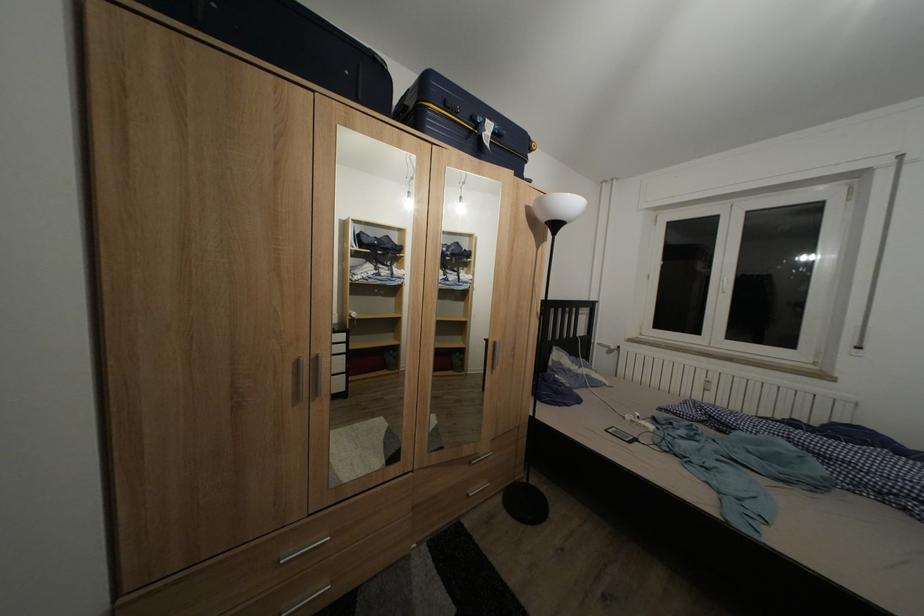
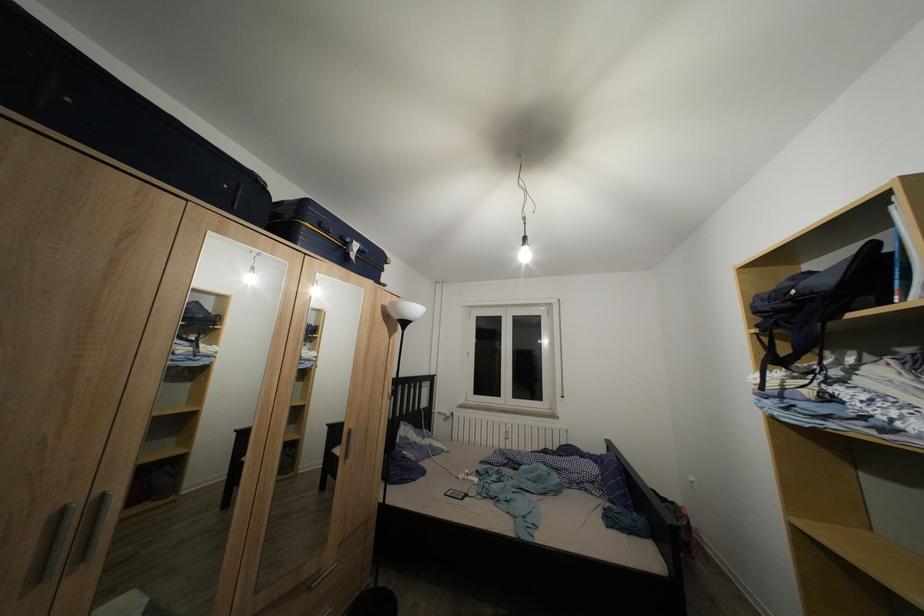
The point at [324,363] is marked in the first image. Where is the corresponding point in the second image?

(111, 503)